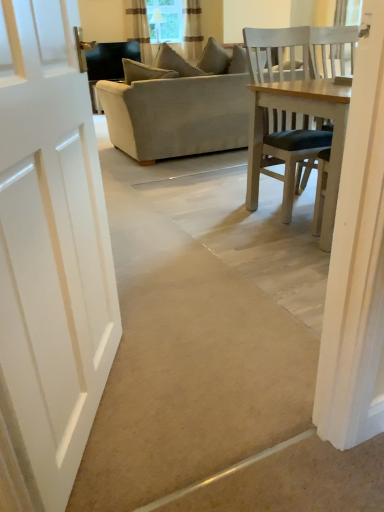
Measure the distance between brown textured curtain at upper center, the 2th curtain when ordered from right to left, and camera.

5.55 meters.

Where is `clear glass window screen at upper center`? The width and height of the screenshot is (384, 512). clear glass window screen at upper center is located at coordinates (165, 20).

What do you see at coordinates (192, 30) in the screenshot? I see `striped fabric curtain at upper center, which ranks as the second curtain in left-to-right order` at bounding box center [192, 30].

Find the location of a particular element. wooden chair at right is located at coordinates (332, 51).

In the scene shown: Could you measure the distance between clear glass window screen at upper center and brown textured curtain at upper center, which ranks as the 1th curtain in left-to-right order?

They are 12.43 inches apart.

Is brown textured curtain at upper center, which ranks as the 1th curtain in left-to-right order, at the back of clear glass window screen at upper center?

No, clear glass window screen at upper center is not facing the opposite direction of brown textured curtain at upper center, which ranks as the 1th curtain in left-to-right order.

Is clear glass window screen at upper center bigger or smaller than brown textured curtain at upper center, the 2th curtain when ordered from right to left?

clear glass window screen at upper center is smaller than brown textured curtain at upper center, the 2th curtain when ordered from right to left.

Between point (171, 35) and point (133, 3), which one is positioned behind?

The point (133, 3) is farther from the camera.

Which is nearer, (200, 53) or (343, 42)?

Point (200, 53).

From the image's perspective, is striped fabric curtain at upper center, arranged as the 1th curtain when viewed from the right, on wooden chair at right?

Yes, from the image's perspective, striped fabric curtain at upper center, arranged as the 1th curtain when viewed from the right, is over wooden chair at right.

Would you consider striped fabric curtain at upper center, arranged as the 1th curtain when viewed from the right, to be distant from wooden chair at right?

Yes, striped fabric curtain at upper center, arranged as the 1th curtain when viewed from the right, is far from wooden chair at right.

In the image, there is a striped fabric curtain at upper center, which ranks as the second curtain in left-to-right order. Where is `chair below it (from the image's perspective)`? This screenshot has width=384, height=512. chair below it (from the image's perspective) is located at coordinates (332, 51).

Considering the sizes of objects clear glass window screen at upper center and beige fabric couch at center in the image provided, who is wider, clear glass window screen at upper center or beige fabric couch at center?

Wider between the two is beige fabric couch at center.

From the image's perspective, who appears lower, clear glass window screen at upper center or beige fabric couch at center?

beige fabric couch at center, from the image's perspective.

How different are the orientations of clear glass window screen at upper center and beige fabric couch at center in degrees?

The angular difference between clear glass window screen at upper center and beige fabric couch at center is 179 degrees.

You are a GUI agent. You are given a task and a screenshot of the screen. Output one action in this format:
    pyautogui.click(x=<x>, y=<y>)
    Task: Click on the window screen above the beige fabric couch at center (from a real-world perspective)
    The width and height of the screenshot is (384, 512).
    Given the screenshot: What is the action you would take?
    pyautogui.click(x=165, y=20)

Which object is positioned more to the left, clear glass window screen at upper center or striped fabric curtain at upper center, arranged as the 1th curtain when viewed from the right?

Positioned to the left is clear glass window screen at upper center.

Considering their positions, is clear glass window screen at upper center located in front of or behind striped fabric curtain at upper center, which ranks as the second curtain in left-to-right order?

Clearly, clear glass window screen at upper center is behind striped fabric curtain at upper center, which ranks as the second curtain in left-to-right order.

Is clear glass window screen at upper center oriented towards striped fabric curtain at upper center, which ranks as the second curtain in left-to-right order?

Yes, clear glass window screen at upper center is turned towards striped fabric curtain at upper center, which ranks as the second curtain in left-to-right order.

Looking at this image, is clear glass window screen at upper center shorter than striped fabric curtain at upper center, which ranks as the second curtain in left-to-right order?

Indeed, clear glass window screen at upper center has a lesser height compared to striped fabric curtain at upper center, which ranks as the second curtain in left-to-right order.

Is striped fabric curtain at upper center, arranged as the 1th curtain when viewed from the right, wider or thinner than clear glass window screen at upper center?

In the image, striped fabric curtain at upper center, arranged as the 1th curtain when viewed from the right, appears to be wider than clear glass window screen at upper center.

Considering the sizes of striped fabric curtain at upper center, arranged as the 1th curtain when viewed from the right, and clear glass window screen at upper center in the image, is striped fabric curtain at upper center, arranged as the 1th curtain when viewed from the right, bigger or smaller than clear glass window screen at upper center?

Considering their sizes, striped fabric curtain at upper center, arranged as the 1th curtain when viewed from the right, takes up more space than clear glass window screen at upper center.

Is striped fabric curtain at upper center, arranged as the 1th curtain when viewed from the right, spatially inside clear glass window screen at upper center, or outside of it?

striped fabric curtain at upper center, arranged as the 1th curtain when viewed from the right, lies outside clear glass window screen at upper center.

From a real-world perspective, count 1st curtains downward from the clear glass window screen at upper center and point to it. Please provide its 2D coordinates.

[(192, 30)]

From the image's perspective, is clear glass window screen at upper center beneath wooden chair at right?

No, from the image's perspective, clear glass window screen at upper center is not below wooden chair at right.

Does clear glass window screen at upper center appear on the right side of wooden chair at right?

No, clear glass window screen at upper center is not to the right of wooden chair at right.

Between clear glass window screen at upper center and wooden chair at right, which one has more height?

wooden chair at right is taller.

Is clear glass window screen at upper center oriented away from wooden chair at right?

No, clear glass window screen at upper center is not facing the opposite direction of wooden chair at right.

From a real-world perspective, who is located higher, brown textured curtain at upper center, which ranks as the 1th curtain in left-to-right order, or clear glass window screen at upper center?

From a 3D spatial view, clear glass window screen at upper center is above.

Between point (145, 17) and point (167, 32), which one is positioned behind?

The point (145, 17) is behind.

How many degrees apart are the facing directions of brown textured curtain at upper center, the 2th curtain when ordered from right to left, and clear glass window screen at upper center?

The facing directions of brown textured curtain at upper center, the 2th curtain when ordered from right to left, and clear glass window screen at upper center are 0.00898 degrees apart.

Find the location of a particular element. window screen that appears above the brown textured curtain at upper center, the 2th curtain when ordered from right to left (from a real-world perspective) is located at coordinates (165, 20).

At what (x,y) coordinates should I click in order to perform the action: click on window screen above the brown textured curtain at upper center, the 2th curtain when ordered from right to left (from the image's perspective). Please return your answer as a coordinate pair (x, y). The width and height of the screenshot is (384, 512). Looking at the image, I should click on (165, 20).

This screenshot has height=512, width=384. What are the coordinates of `chair in front of the striped fabric curtain at upper center, arranged as the 1th curtain when viewed from the right` in the screenshot? It's located at (332, 51).

Based on their spatial positions, is striped fabric curtain at upper center, which ranks as the second curtain in left-to-right order, or brown textured curtain at upper center, the 2th curtain when ordered from right to left, further from beige fabric couch at center?

brown textured curtain at upper center, the 2th curtain when ordered from right to left, is positioned further to the anchor beige fabric couch at center.

Which object lies nearer to the anchor point clear glass window screen at upper center, brown textured curtain at upper center, which ranks as the 1th curtain in left-to-right order, or beige fabric couch at center?

brown textured curtain at upper center, which ranks as the 1th curtain in left-to-right order.

Based on their spatial positions, is beige fabric couch at center or striped fabric curtain at upper center, arranged as the 1th curtain when viewed from the right, closer to wooden chair at right?

beige fabric couch at center is closer to wooden chair at right.

When comparing their distances from clear glass window screen at upper center, does wooden chair at right or beige fabric couch at center seem further?

wooden chair at right is further to clear glass window screen at upper center.

Estimate the real-world distances between objects in this image. Which object is further from clear glass window screen at upper center, beige fabric couch at center or wooden chair at right?

wooden chair at right.

Based on the photo, estimate the real-world distances between objects in this image. Which object is closer to beige fabric couch at center, brown textured curtain at upper center, the 2th curtain when ordered from right to left, or wooden chair at right?

wooden chair at right lies closer to beige fabric couch at center than the other object.

Looking at the image, which one is located further to wooden chair at right, clear glass window screen at upper center or striped fabric curtain at upper center, which ranks as the second curtain in left-to-right order?

clear glass window screen at upper center lies further to wooden chair at right than the other object.

When comparing their distances from beige fabric couch at center, does striped fabric curtain at upper center, which ranks as the second curtain in left-to-right order, or clear glass window screen at upper center seem further?

clear glass window screen at upper center is positioned further to the anchor beige fabric couch at center.

Find the location of `studio couch located between wooden chair at right and clear glass window screen at upper center in the depth direction`. studio couch located between wooden chair at right and clear glass window screen at upper center in the depth direction is located at coordinates (178, 106).

The height and width of the screenshot is (512, 384). Identify the location of curtain between wooden chair at right and striped fabric curtain at upper center, arranged as the 1th curtain when viewed from the right, from front to back. (140, 29).

Locate an element on the screen. The image size is (384, 512). window screen between brown textured curtain at upper center, which ranks as the 1th curtain in left-to-right order, and striped fabric curtain at upper center, arranged as the 1th curtain when viewed from the right, from left to right is located at coordinates (165, 20).

Identify the location of curtain between beige fabric couch at center and striped fabric curtain at upper center, arranged as the 1th curtain when viewed from the right, in the front-back direction. The height and width of the screenshot is (512, 384). (140, 29).